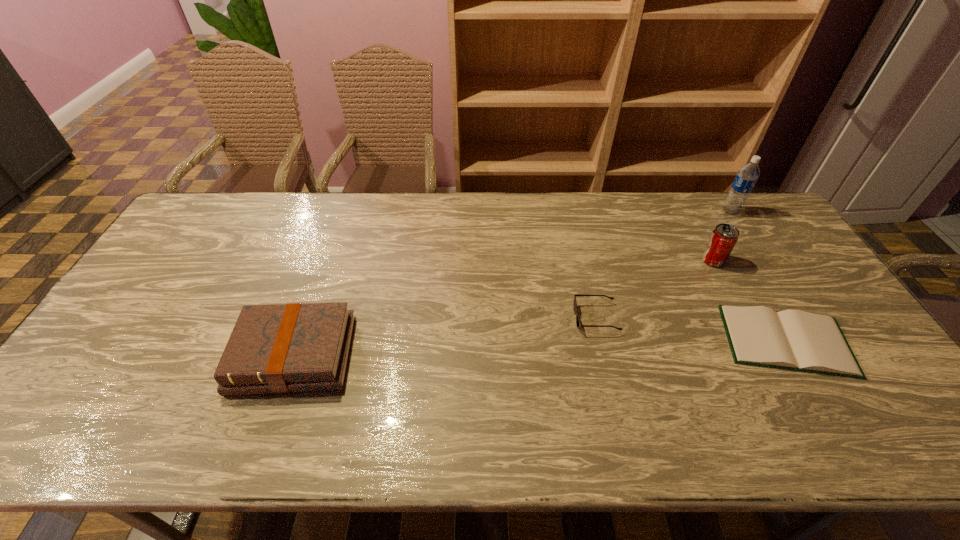
At what (x,y) coordinates should I click in order to perform the action: click on free spot located 0.130m on the front of the tallest object. Please return your answer as a coordinate pair (x, y). Image resolution: width=960 pixels, height=540 pixels. Looking at the image, I should click on (750, 241).

You are a GUI agent. You are given a task and a screenshot of the screen. Output one action in this format:
    pyautogui.click(x=<x>, y=<y>)
    Task: Click on the free space located 0.150m on the front of the fourth nearest object
    Image resolution: width=960 pixels, height=540 pixels.
    Given the screenshot: What is the action you would take?
    pyautogui.click(x=736, y=306)

Identify the location of free space located on the right of the taller hardback book. coord(442,355).

What are the coordinates of `free space located 0.210m on the front lenses of the fourth tallest object` in the screenshot? It's located at (499, 318).

Identify the location of vacant space located 0.250m on the front lenses of the fourth tallest object. The height and width of the screenshot is (540, 960). (485, 318).

Locate an element on the screen. The width and height of the screenshot is (960, 540). vacant space located 0.050m on the front lenses of the fourth tallest object is located at coordinates (557, 318).

Identify the location of vacant space located on the left of the shortest object. (683, 341).

In order to click on object located at the far edge in this screenshot , I will do `click(746, 178)`.

Locate an element on the screen. water bottle present at the right edge is located at coordinates (746, 178).

At what (x,y) coordinates should I click in order to perform the action: click on hardback book that is at the right edge. Please return your answer as a coordinate pair (x, y). This screenshot has width=960, height=540. Looking at the image, I should click on (796, 340).